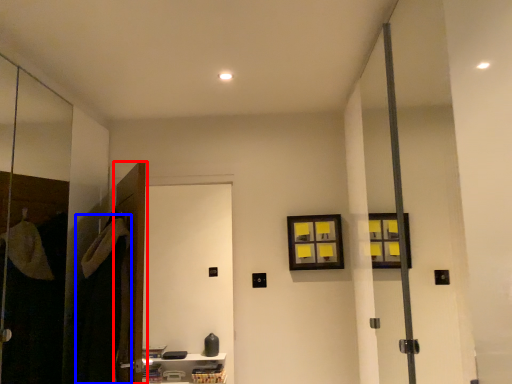
Question: Which point is further to the camera, door (highlighted by a red box) or robe (highlighted by a blue box)?

Choices:
 (A) door
 (B) robe

Answer: (A)